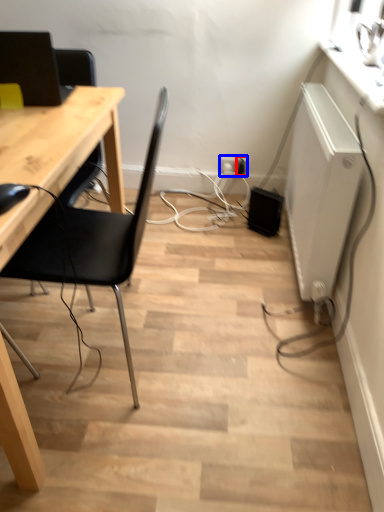
Question: Which object appears farthest to the camera in this image, electric outlet (highlighted by a red box) or electric outlet (highlighted by a blue box)?

Choices:
 (A) electric outlet
 (B) electric outlet

Answer: (B)